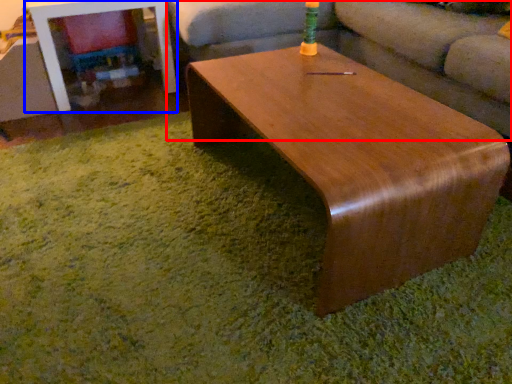
Question: Which of the following is the farthest to the observer, studio couch (highlighted by a red box) or table (highlighted by a blue box)?

Choices:
 (A) studio couch
 (B) table

Answer: (B)